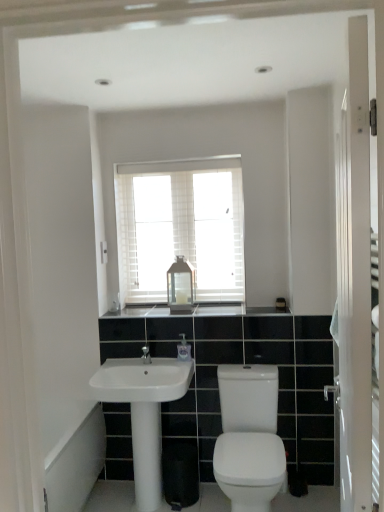
Question: Is white glossy sink at center spatially inside white glossy screen door at right, or outside of it?

Choices:
 (A) inside
 (B) outside

Answer: (B)

Question: From a real-world perspective, relative to white glossy screen door at right, is white glossy sink at center vertically above or below?

Choices:
 (A) below
 (B) above

Answer: (A)

Question: Considering the real-world distances, which object is farthest from the translucent plastic soap dispenser at center?

Choices:
 (A) white glossy screen door at right
 (B) black granite countertop at center
 (C) white wooden blinds at upper center
 (D) clear glass lantern at center
 (E) white glossy toilet at lower right

Answer: (A)

Question: Considering the real-world distances, which object is closest to the white glossy bath at lower left?

Choices:
 (A) white wooden blinds at upper center
 (B) white glossy screen door at right
 (C) translucent plastic soap dispenser at center
 (D) white glossy sink at center
 (E) clear glass lantern at center

Answer: (D)